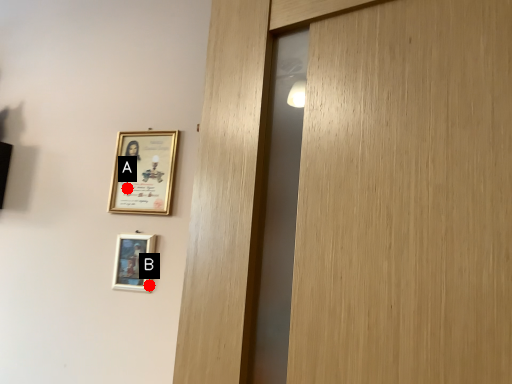
Question: Two points are circled on the image, labeled by A and B beside each circle. Which point appears closest to the camera in this image?

Choices:
 (A) A is closer
 (B) B is closer

Answer: (B)